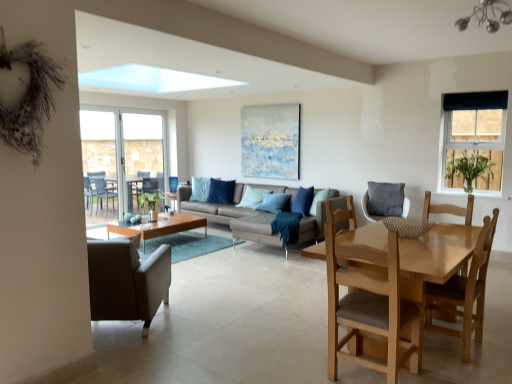
Question: From their relative heights in the image, would you say dark blue fabric at upper right is taller or shorter than gray fabric cushion at center, the 4th chair viewed from the front?

Choices:
 (A) short
 (B) tall

Answer: (A)

Question: From a real-world perspective, is dark blue fabric at upper right above or below gray fabric cushion at center, acting as the first chair starting from the right?

Choices:
 (A) above
 (B) below

Answer: (A)

Question: Based on their relative distances, which object is farther from the light brown wooden chair at lower right, positioned as the second chair in left-to-right order?

Choices:
 (A) clear glass patio door at left, which ranks as the second window in right-to-left order
 (B) dark blue fabric at upper right
 (C) gray fabric cushion at center, the first chair viewed from the back
 (D) light brown wooden chair at lower right, placed as the 3th chair when sorted from left to right
 (E) clear glass door at left, placed as the 2th screen door when sorted from left to right

Answer: (E)

Question: Estimate the real-world distances between objects in this image. Which object is closer to the light brown wooden chair at lower right, placed as the 3th chair when sorted from left to right?

Choices:
 (A) light brown wooden chair at lower right, which is counted as the fourth chair, starting from the back
 (B) gray fabric cushion at center, the 4th chair viewed from the front
 (C) blue plastic chairs at left, which is the 1th screen door from left to right
 (D) matte wood coffee table at center
 (E) leather couch at center

Answer: (A)